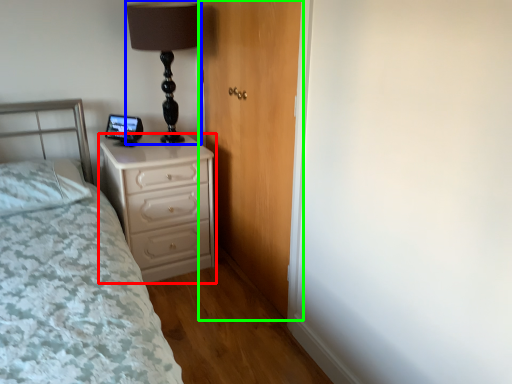
Question: Estimate the real-world distances between objects in this image. Which object is closer to chest of drawers (highlighted by a red box), table lamp (highlighted by a blue box) or door (highlighted by a green box)?

Choices:
 (A) table lamp
 (B) door

Answer: (B)